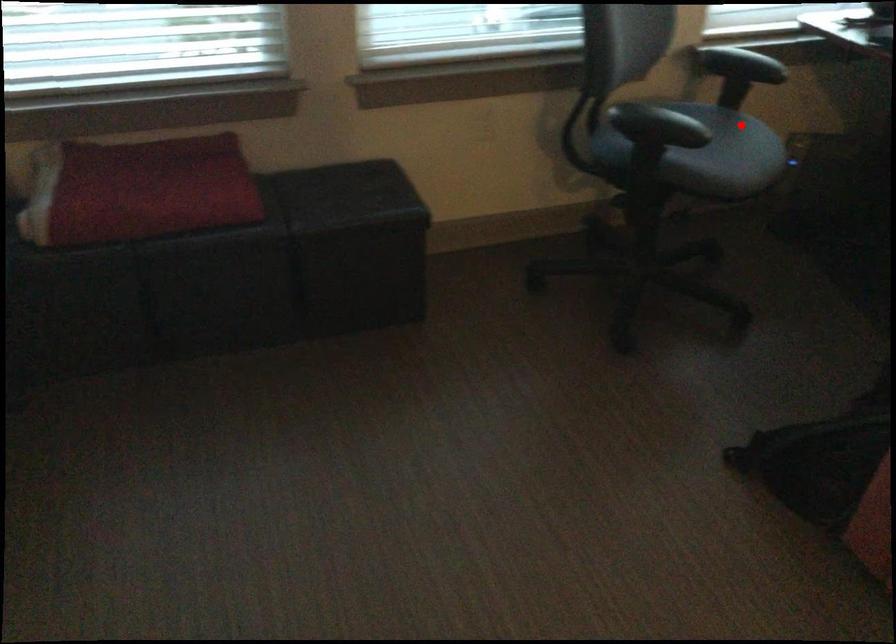
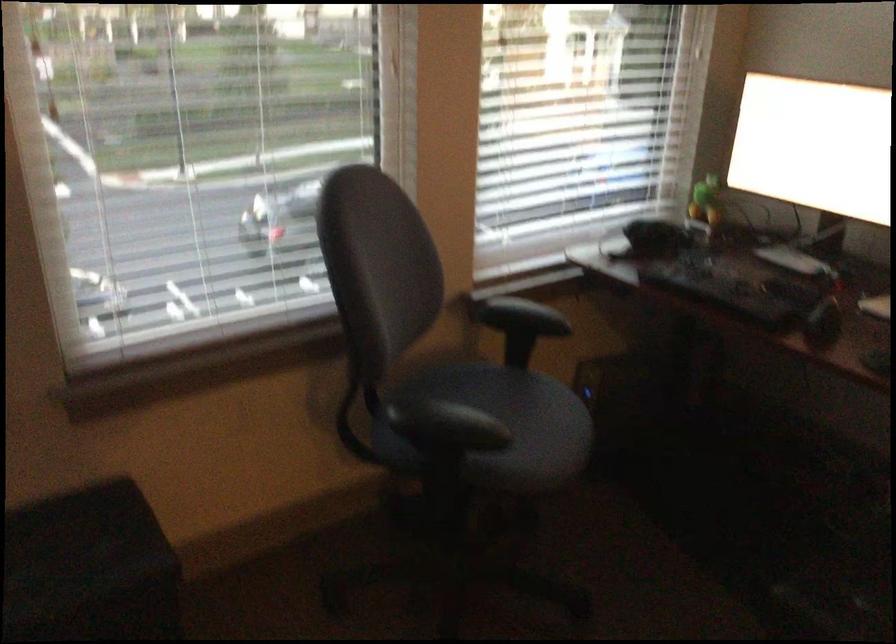
Find the pixel in the second image that matches the highlighted location in the first image.

(533, 404)